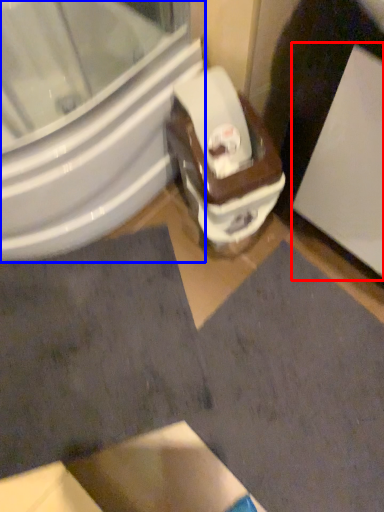
Question: Which object appears farthest to the camera in this image, screen door (highlighted by a red box) or bidet (highlighted by a blue box)?

Choices:
 (A) screen door
 (B) bidet

Answer: (B)